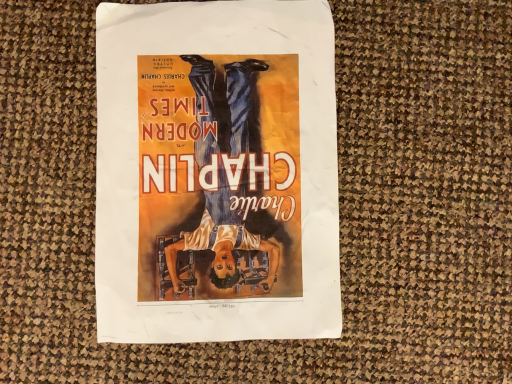
What are the coordinates of `matte paper poster at center` in the screenshot? It's located at (216, 172).

Describe the element at coordinates (216, 172) in the screenshot. This screenshot has height=384, width=512. I see `matte paper poster at center` at that location.

Consider the image. Measure the distance between matte paper poster at center and camera.

The distance of matte paper poster at center from camera is 14.29 inches.

Where is `matte paper poster at center`? This screenshot has width=512, height=384. matte paper poster at center is located at coordinates (216, 172).